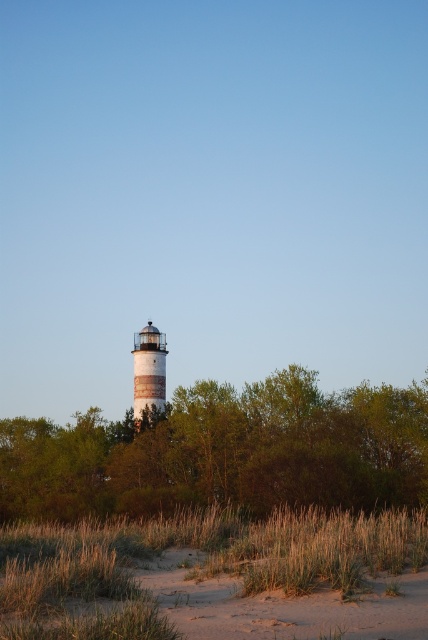
Question: Is the position of green leafy tree at center less distant than that of brown sandy beach at lower center?

Choices:
 (A) no
 (B) yes

Answer: (A)

Question: Is green leafy tree at center further to camera compared to white painted wood lighthouse at center?

Choices:
 (A) no
 (B) yes

Answer: (A)

Question: Is brown sandy beach at lower center to the left of white painted wood lighthouse at center from the viewer's perspective?

Choices:
 (A) no
 (B) yes

Answer: (A)

Question: Among these points, which one is farthest from the camera?

Choices:
 (A) (154, 355)
 (B) (118, 556)

Answer: (A)

Question: Which point is closer to the camera?

Choices:
 (A) green leafy tree at center
 (B) brown sandy beach at lower center

Answer: (B)

Question: Which object appears farthest from the camera in this image?

Choices:
 (A) green leafy tree at center
 (B) brown sandy beach at lower center

Answer: (A)